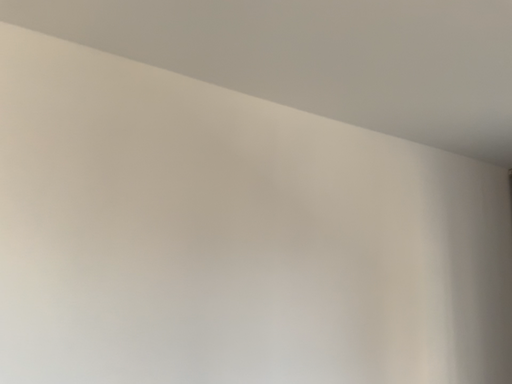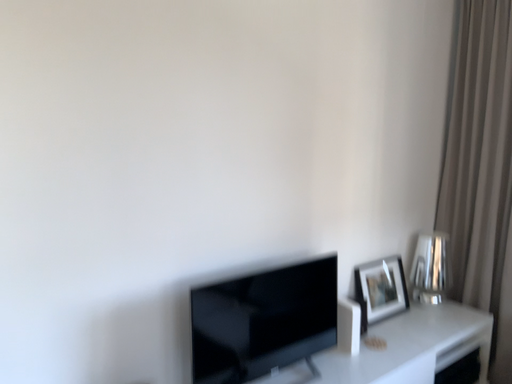
Question: How did the camera likely rotate when shooting the video?

Choices:
 (A) rotated right
 (B) rotated left

Answer: (A)